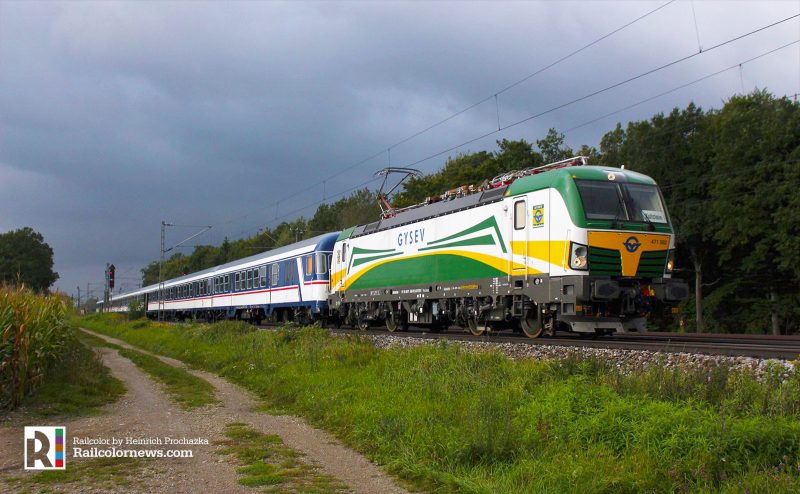
Locate an element on the screen. The width and height of the screenshot is (800, 494). windows is located at coordinates (258, 276), (250, 276), (244, 276), (238, 276), (218, 281), (182, 286), (165, 289).